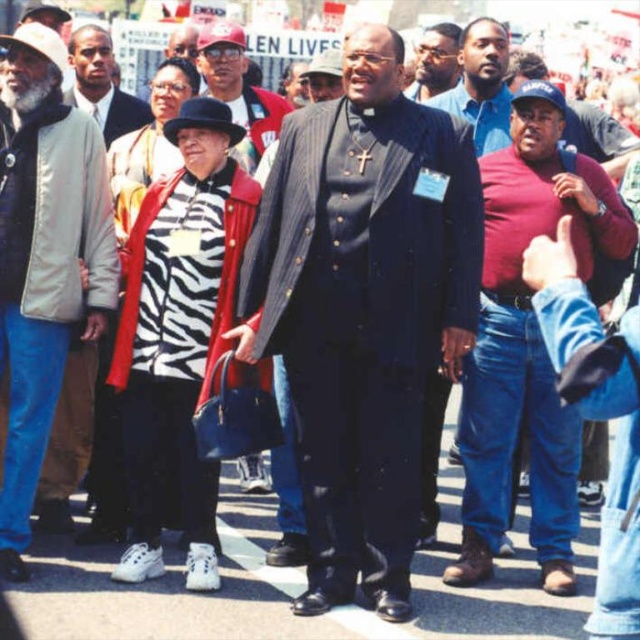
Based on the scene description, which object takes up more area in the image? The matte red shirt at center or the dark skin smooth face at upper left?

The dark skin smooth face at upper left occupies more space than the matte red shirt at center according to the description.

You are a photographer trying to capture a candid shot of the matte black suit at center and the light gray jacket at left. Given that your camera has a depth of field that can clearly focus on subjects within 30 feet of each other, will both subjects be in focus simultaneously?

The distance between the matte black suit at center and the light gray jacket at left is 31.49 feet. Since the camera can only focus on subjects within 30 feet of each other, the two subjects will not be in focus simultaneously.